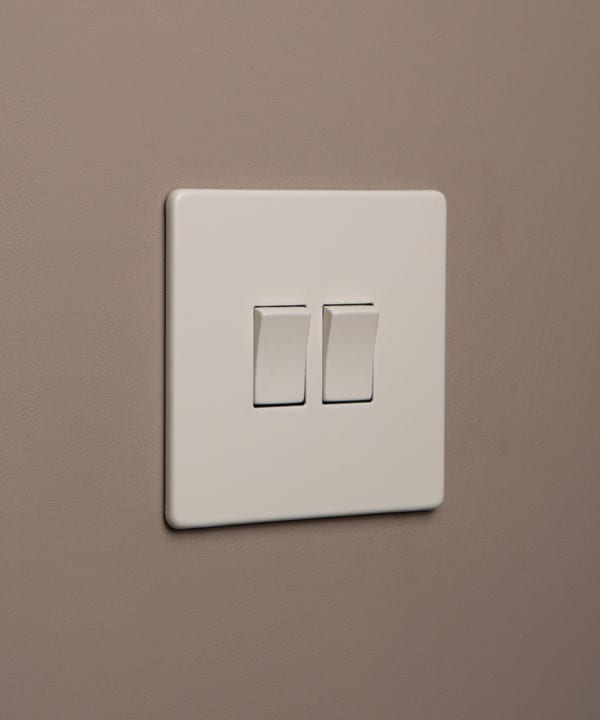
Find the location of a particular element. right switch is located at coordinates (359, 400).